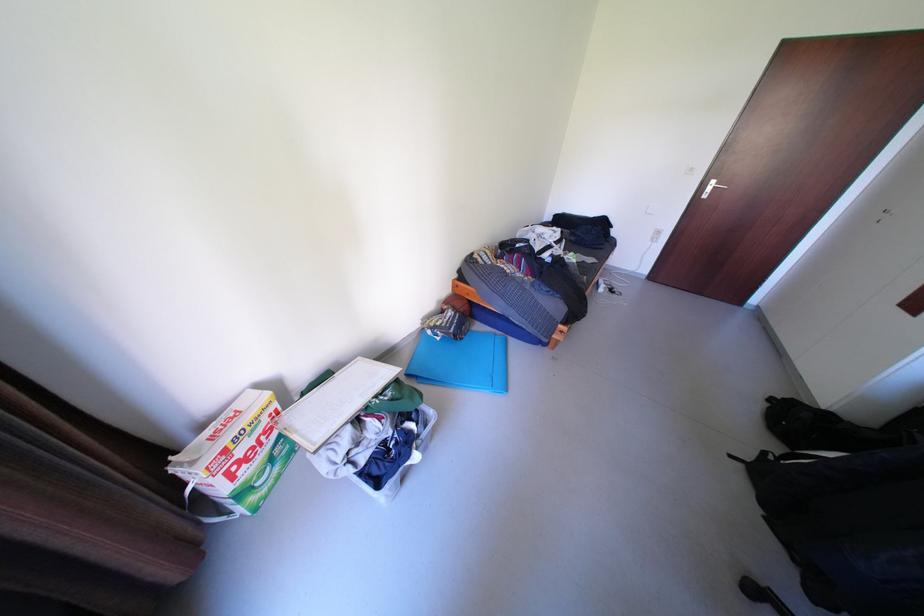
Where is `detergent box handle`? This screenshot has height=616, width=924. detergent box handle is located at coordinates (236, 456).